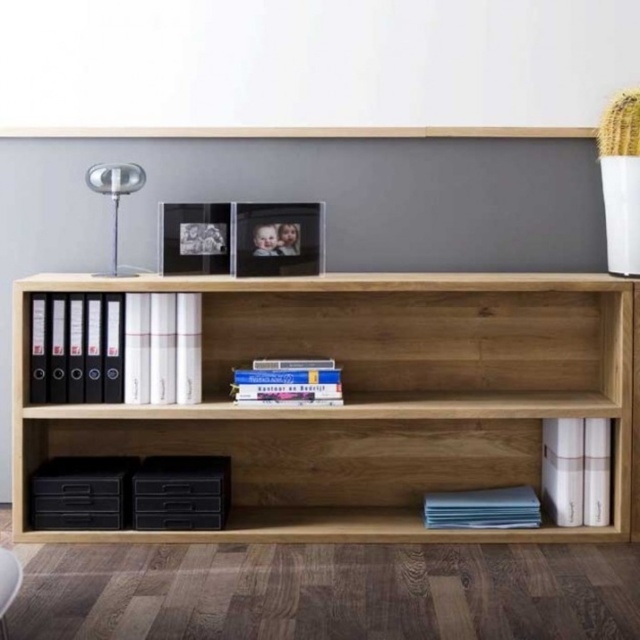
You are organizing items on the minimalist wooden shelf unit. You have a white matte book at lower right and a blue paper at lower right. Which item has a smaller width?

The white matte book at lower right has a smaller width than the blue paper at lower right.

You are organizing a bookshelf and need to place the hardcover book at center and the white fabric armchair at lower left. Given their sizes, which object should you place first to ensure proper fitting?

The hardcover book at center has a larger width than the white fabric armchair at lower left, so you should place the hardcover book at center first to accommodate its size before placing the white fabric armchair at lower left.